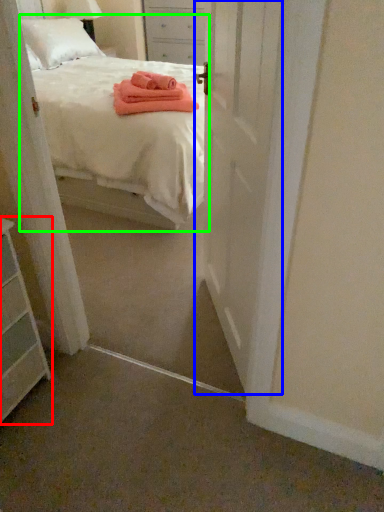
Question: Based on their relative distances, which object is farther from chest of drawers (highlighted by a red box)? Choose from door (highlighted by a blue box) and bed (highlighted by a green box).

Choices:
 (A) door
 (B) bed

Answer: (B)